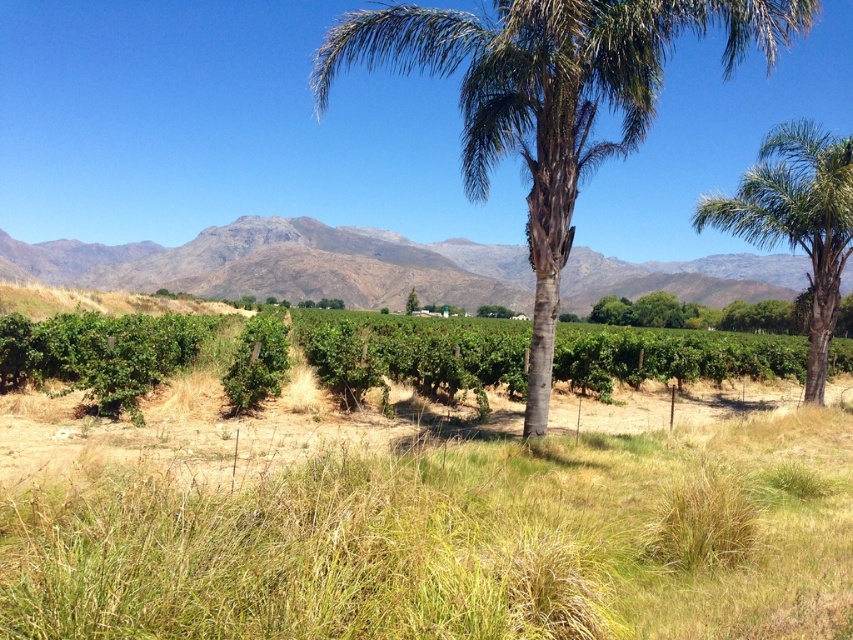
Question: Is green grass at center in front of green leafy palm tree at center?

Choices:
 (A) no
 (B) yes

Answer: (B)

Question: Among these points, which one is farthest from the camera?

Choices:
 (A) (201, 234)
 (B) (122, 616)

Answer: (A)

Question: Does gray rocky mountain at center have a lesser width compared to green leafy palm tree at center?

Choices:
 (A) no
 (B) yes

Answer: (A)

Question: Based on their relative distances, which object is nearer to the green leafy hedge at center?

Choices:
 (A) green grass at center
 (B) green leafy palm tree at center

Answer: (A)

Question: Where is green grass at center located in relation to gray rocky mountain at center in the image?

Choices:
 (A) below
 (B) above

Answer: (A)

Question: Which object is farther from the camera taking this photo?

Choices:
 (A) green leafy hedge at center
 (B) green textured palm tree at center
 (C) green grass at center
 (D) green leafy palm tree at center

Answer: (D)